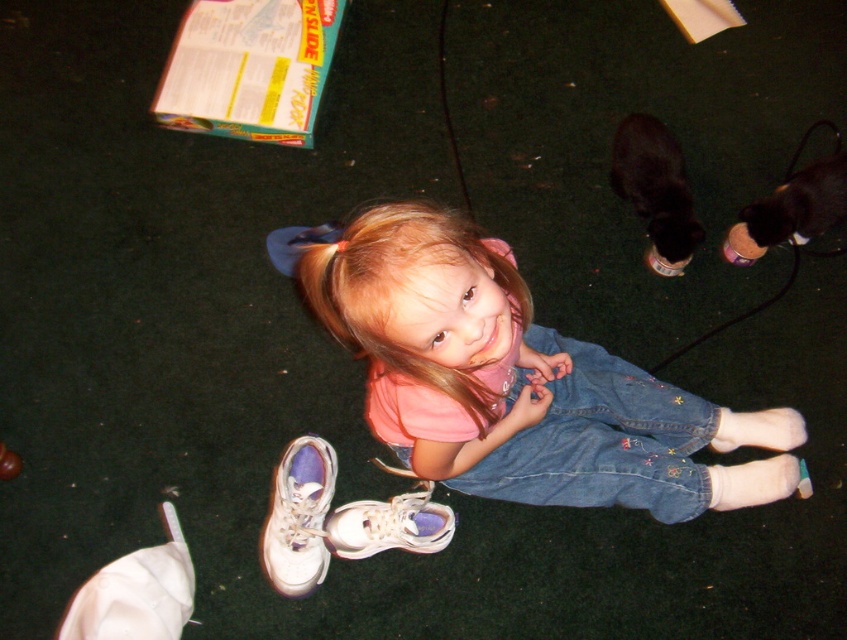
The child is trying to decide which footwear to wear. Which one is bigger between the white leather shoe at lower center and the white leather sneaker at lower center?

The white leather shoe at lower center is larger in size than the white leather sneaker at lower center.

You are helping a child choose between the pink denim dress at center and the white leather sneaker at lower center. Which item is located to the right of the other?

The pink denim dress at center is positioned on the right side of white leather sneaker at lower center.